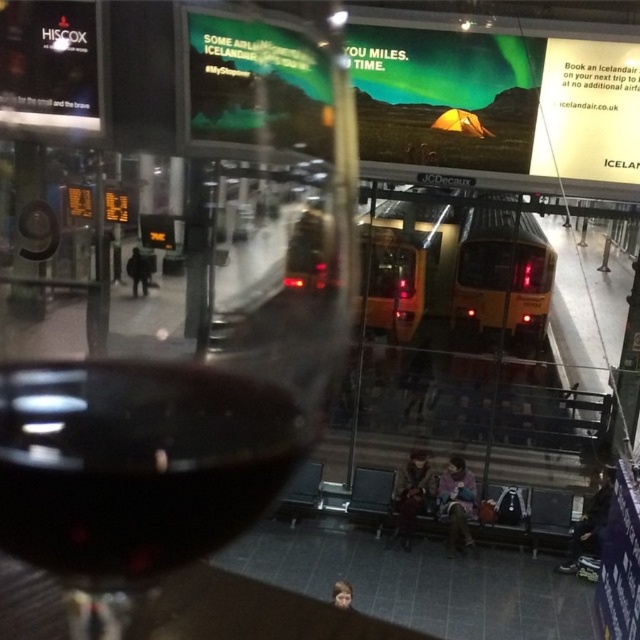
Can you confirm if opaque dark red wine at center is shorter than dark glass wine at lower left?

Incorrect, opaque dark red wine at center's height does not fall short of dark glass wine at lower left's.

You are a GUI agent. You are given a task and a screenshot of the screen. Output one action in this format:
    pyautogui.click(x=<x>, y=<y>)
    Task: Click on the opaque dark red wine at center
    
    Given the screenshot: What is the action you would take?
    pyautogui.click(x=172, y=291)